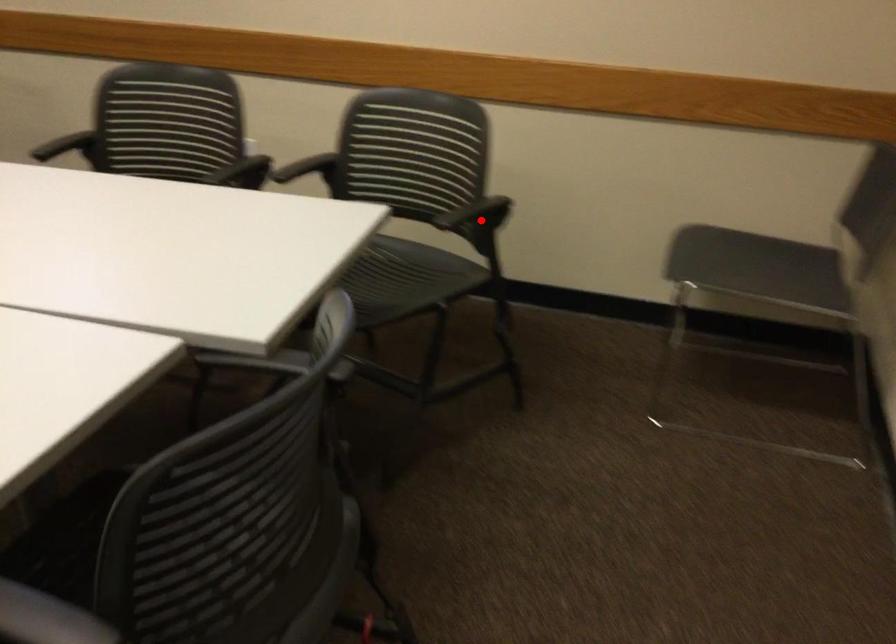
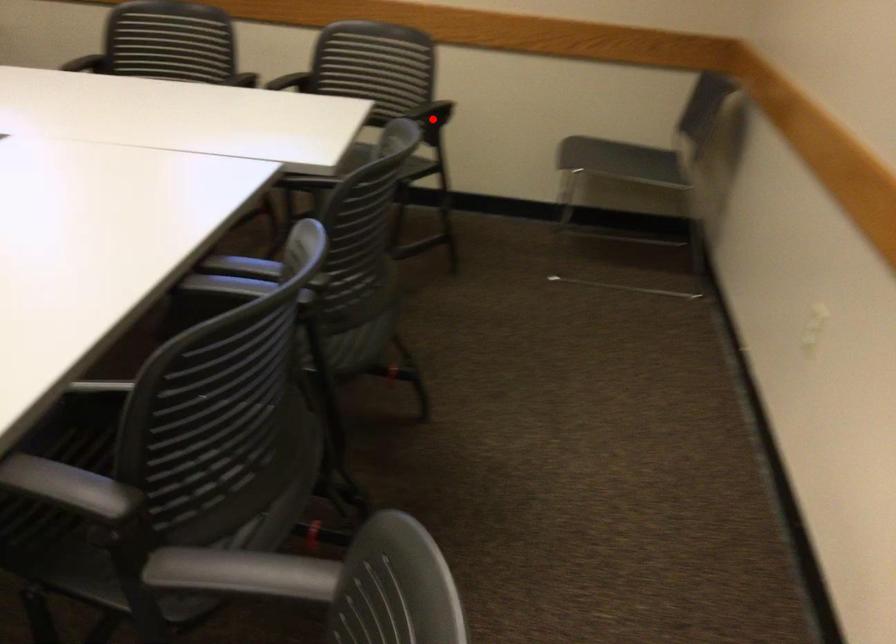
I am providing you with two images of the same scene from different viewpoints. A red point is marked on the first image and another point is marked on the second image. Does the point marked in image1 correspond to the same location as the one in image2?

Yes